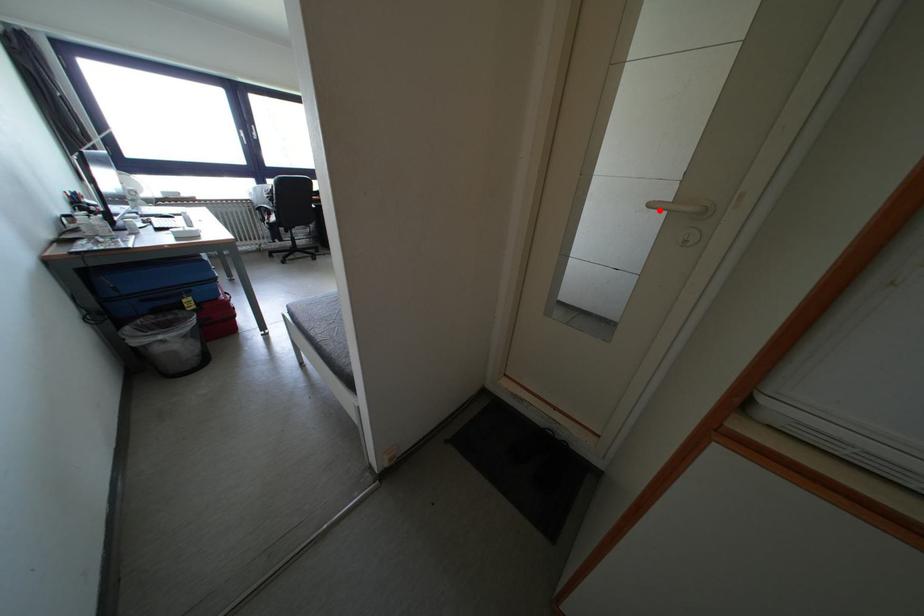
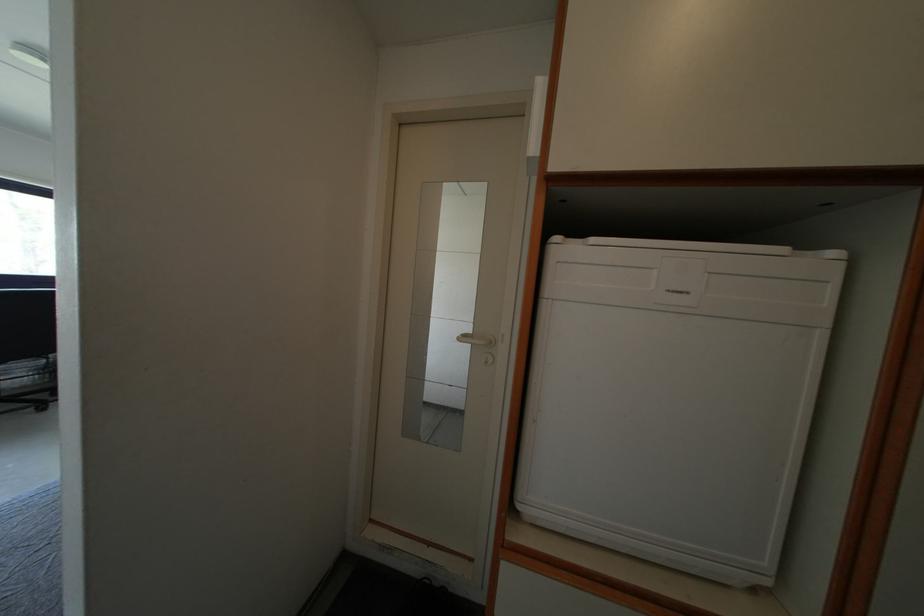
Question: I am providing you with two images of the same scene from different viewpoints. A red point is shown in image1. For the corresponding object point in image2, is it positioned nearer or farther from the camera?

Choices:
 (A) Nearer
 (B) Farther

Answer: (B)